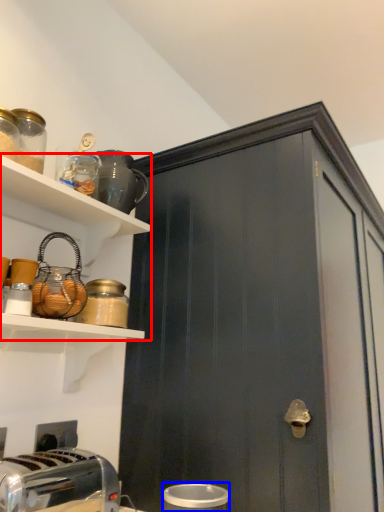
Question: Which of the following is the closest to the observer, shelf (highlighted by a red box) or appliance (highlighted by a blue box)?

Choices:
 (A) shelf
 (B) appliance

Answer: (B)